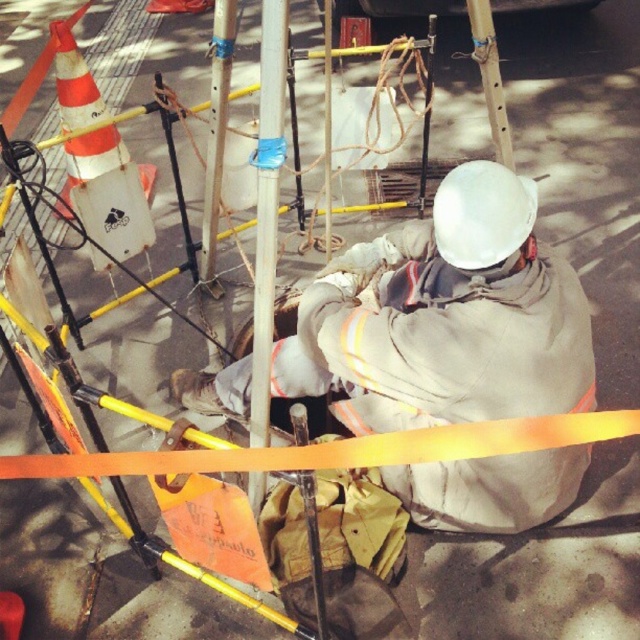
You are a safety inspector checking the construction site. You notice the gray fabric construction worker at center and the smooth white pole at center. Which object is wider?

The gray fabric construction worker at center is wider than the smooth white pole at center according to the description.

You are a safety inspector assessing the construction site. You notice the orange reflective traffic cone at upper left and the smooth white pole at center. Which object is wider?

The orange reflective traffic cone at upper left is wider than the smooth white pole at center.